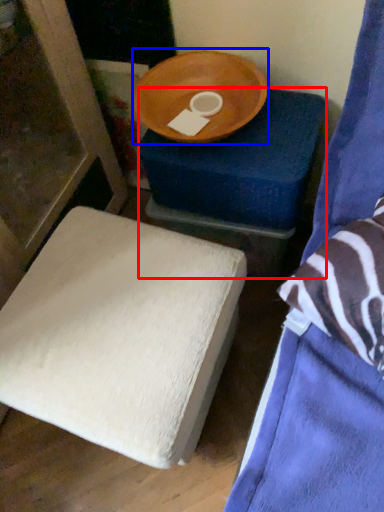
Question: Which object is further to the camera taking this photo, furniture (highlighted by a red box) or round table (highlighted by a blue box)?

Choices:
 (A) furniture
 (B) round table

Answer: (A)